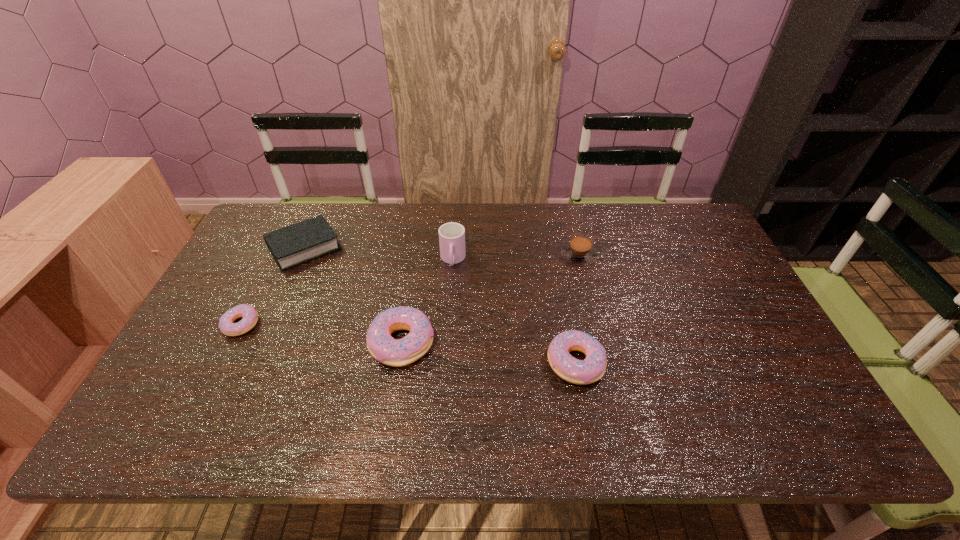
You are a GUI agent. You are given a task and a screenshot of the screen. Output one action in this format:
    pyautogui.click(x=<x>, y=<y>)
    Task: Click on the shortest doughnut
    This screenshot has width=960, height=540.
    Given the screenshot: What is the action you would take?
    pyautogui.click(x=250, y=316)

Find the location of a particular element. The image size is (960, 540). the shortest object is located at coordinates (250, 316).

Where is `the second doughnut from right to left`? the second doughnut from right to left is located at coordinates (382, 346).

At what (x,y) coordinates should I click in order to perform the action: click on the second shortest doughnut. Please return your answer as a coordinate pair (x, y). This screenshot has width=960, height=540. Looking at the image, I should click on (591, 369).

I want to click on Bible, so click(x=295, y=244).

The height and width of the screenshot is (540, 960). I want to click on the tallest object, so click(451, 235).

Identify the location of cappuccino. The image size is (960, 540). (579, 250).

I want to click on vacant region located on the right of the shortest doughnut, so click(362, 324).

Image resolution: width=960 pixels, height=540 pixels. In order to click on free region located 0.310m on the back of the second doughnut from right to left in this screenshot , I will do `click(418, 245)`.

Locate an element on the screen. free space located on the back of the rightmost doughnut is located at coordinates (557, 258).